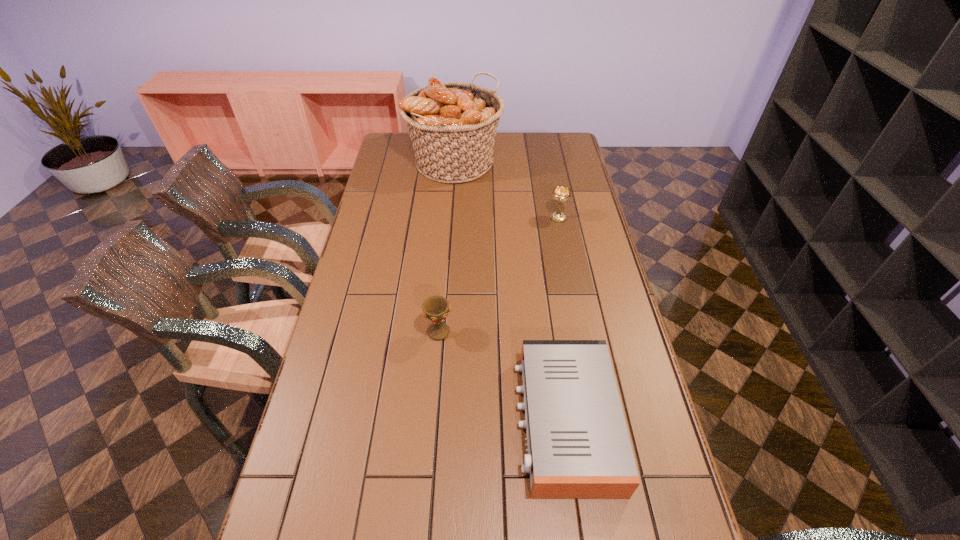
The width and height of the screenshot is (960, 540). What are the coordinates of `blank space located on the right of the nearer chalice` in the screenshot? It's located at (496, 332).

You are a GUI agent. You are given a task and a screenshot of the screen. Output one action in this format:
    pyautogui.click(x=<x>, y=<y>)
    Task: Click on the free space located 0.370m on the control panel of the radio receiver
    The height and width of the screenshot is (540, 960).
    Given the screenshot: What is the action you would take?
    pyautogui.click(x=372, y=421)

You are a GUI agent. You are given a task and a screenshot of the screen. Output one action in this format:
    pyautogui.click(x=<x>, y=<y>)
    Task: Click on the free space located on the control panel of the radio receiver
    This screenshot has width=960, height=540.
    Given the screenshot: What is the action you would take?
    pyautogui.click(x=392, y=421)

The height and width of the screenshot is (540, 960). I want to click on vacant space located on the control panel of the radio receiver, so click(423, 421).

Locate an element on the screen. The image size is (960, 540). object located at the far edge is located at coordinates (452, 125).

Image resolution: width=960 pixels, height=540 pixels. Identify the location of object that is positioned at the left edge. (452, 125).

Find the location of a particular element. The width and height of the screenshot is (960, 540). chalice that is at the right edge is located at coordinates (561, 194).

I want to click on radio receiver that is positioned at the right edge, so click(578, 445).

In order to click on object that is at the far left corner in this screenshot , I will do `click(452, 125)`.

Locate an element on the screen. The height and width of the screenshot is (540, 960). blank space at the far edge of the desktop is located at coordinates (510, 140).